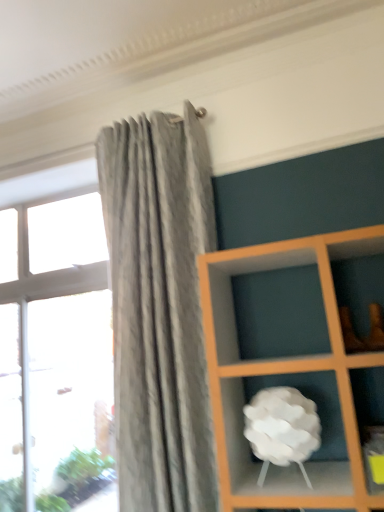
This screenshot has height=512, width=384. What do you see at coordinates (53, 340) in the screenshot? I see `transparent glass window at left` at bounding box center [53, 340].

The height and width of the screenshot is (512, 384). In order to click on transparent glass window at left in this screenshot , I will do `click(53, 340)`.

In order to face transparent glass window at left, should I rotate leftwards or rightwards?

You should look left and rotate roughly 16.016 degrees.

This screenshot has height=512, width=384. What do you see at coordinates (247, 450) in the screenshot?
I see `white matte cloud at center` at bounding box center [247, 450].

Locate an element on the screen. The height and width of the screenshot is (512, 384). white matte cloud at center is located at coordinates click(247, 450).

Find the location of a particular element. This screenshot has width=384, height=512. transparent glass window at left is located at coordinates (53, 340).

Consider the image. Is transparent glass window at left at the left side of white matte cloud at center?

Yes, transparent glass window at left is to the left of white matte cloud at center.

Is transparent glass window at left closer to the viewer compared to white matte cloud at center?

No, transparent glass window at left is behind white matte cloud at center.

Is point (104, 234) farther from camera compared to point (215, 417)?

Yes.

From the image's perspective, would you say transparent glass window at left is shown under white matte cloud at center?

Indeed, from the image's perspective, transparent glass window at left is shown beneath white matte cloud at center.

From a real-world perspective, is transparent glass window at left physically above white matte cloud at center?

Yes, from a real-world perspective, transparent glass window at left is over white matte cloud at center

Between transparent glass window at left and white matte cloud at center, which one has smaller width?

Thinner between the two is transparent glass window at left.

Considering the sizes of objects transparent glass window at left and white matte cloud at center in the image provided, who is taller, transparent glass window at left or white matte cloud at center?

transparent glass window at left is taller.

Considering the sizes of objects transparent glass window at left and white matte cloud at center in the image provided, who is smaller, transparent glass window at left or white matte cloud at center?

white matte cloud at center is smaller.

Is transparent glass window at left inside the boundaries of white matte cloud at center, or outside?

transparent glass window at left is not inside white matte cloud at center, it's outside.

Are transparent glass window at left and white matte cloud at center beside each other?

No, transparent glass window at left is not with white matte cloud at center.

Is transparent glass window at left oriented away from white matte cloud at center?

No, transparent glass window at left is not facing away from white matte cloud at center.

How far apart are transparent glass window at left and white matte cloud at center?

1.44 meters.

The width and height of the screenshot is (384, 512). Find the location of `cabinet on the right of transparent glass window at left`. cabinet on the right of transparent glass window at left is located at coordinates (247, 450).

Does white matte cloud at center appear on the right side of transparent glass window at left?

Indeed, white matte cloud at center is positioned on the right side of transparent glass window at left.

Is white matte cloud at center in front of or behind transparent glass window at left in the image?

Clearly, white matte cloud at center is in front of transparent glass window at left.

Which is further, (233, 489) or (72, 439)?

The point (72, 439) is more distant.

From the image's perspective, is white matte cloud at center beneath transparent glass window at left?

No, from the image's perspective, white matte cloud at center is not below transparent glass window at left.

From a real-world perspective, which is physically below, white matte cloud at center or transparent glass window at left?

white matte cloud at center, from a real-world perspective.

Does white matte cloud at center have a lesser width compared to transparent glass window at left?

No.

In terms of height, does white matte cloud at center look taller or shorter compared to transparent glass window at left?

Considering their sizes, white matte cloud at center has less height than transparent glass window at left.

Can you confirm if white matte cloud at center is bigger than transparent glass window at left?

No, white matte cloud at center is not bigger than transparent glass window at left.

Does white matte cloud at center contain transparent glass window at left?

No, transparent glass window at left is located outside of white matte cloud at center.

Is white matte cloud at center far away from transparent glass window at left?

Yes, white matte cloud at center and transparent glass window at left are located far from each other.

Is white matte cloud at center facing away from transparent glass window at left?

No.

How many degrees apart are the facing directions of white matte cloud at center and transparent glass window at left?

The angular difference between white matte cloud at center and transparent glass window at left is 1.49 degrees.

How distant is white matte cloud at center from transparent glass window at left?

They are 4.74 feet apart.

The width and height of the screenshot is (384, 512). In order to click on window below the white matte cloud at center (from the image's perspective) in this screenshot , I will do `click(53, 340)`.

Find the location of a particular element. The width and height of the screenshot is (384, 512). window that appears below the white matte cloud at center (from the image's perspective) is located at coordinates (53, 340).

You are a GUI agent. You are given a task and a screenshot of the screen. Output one action in this format:
    pyautogui.click(x=<x>, y=<y>)
    Task: Click on the cabinet that appears below the transparent glass window at left (from a real-world perspective)
    This screenshot has width=384, height=512.
    Given the screenshot: What is the action you would take?
    pyautogui.click(x=247, y=450)